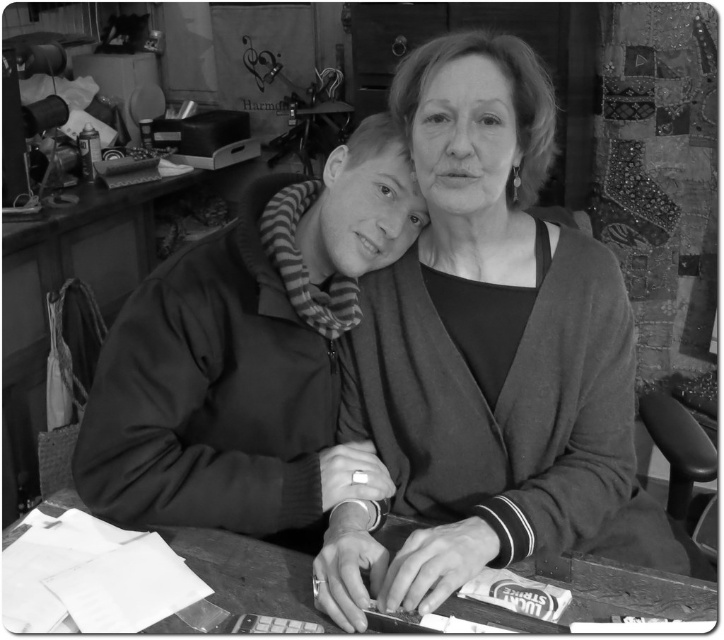
Question: Can you confirm if matte black jacket at center is smaller than wooden table at lower center?

Choices:
 (A) no
 (B) yes

Answer: (A)

Question: Which point is farther from the camera taking this photo?

Choices:
 (A) (258, 307)
 (B) (584, 310)

Answer: (B)

Question: Can you confirm if matte gray sweater at center is smaller than matte black jacket at center?

Choices:
 (A) yes
 (B) no

Answer: (B)

Question: Where is matte gray sweater at center located in relation to wooden table at lower center in the image?

Choices:
 (A) below
 (B) above

Answer: (B)

Question: Considering the real-world distances, which object is farthest from the matte gray sweater at center?

Choices:
 (A) wooden table at lower center
 (B) matte black jacket at center

Answer: (A)

Question: Which of these objects is positioned closest to the matte black jacket at center?

Choices:
 (A) matte gray sweater at center
 (B) wooden table at lower center

Answer: (A)